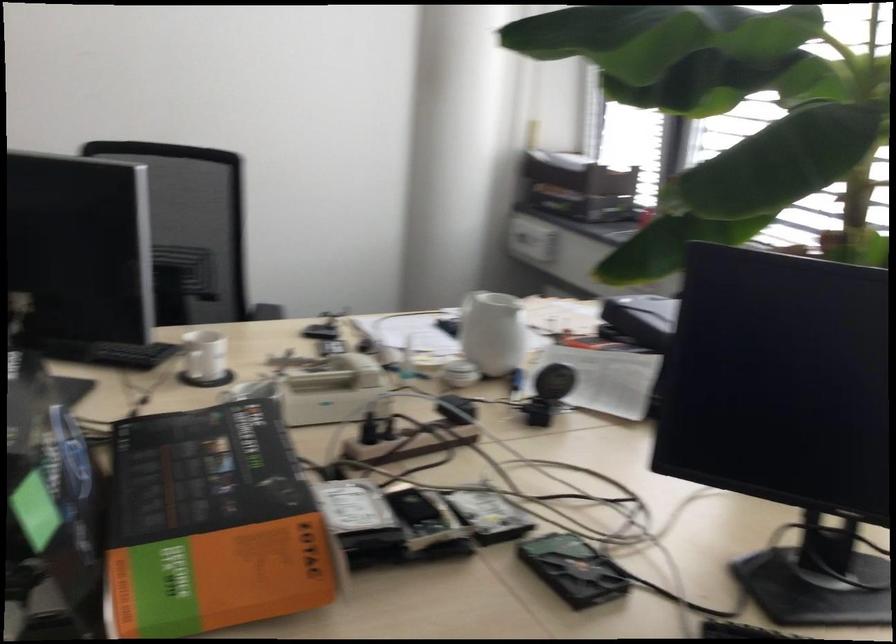
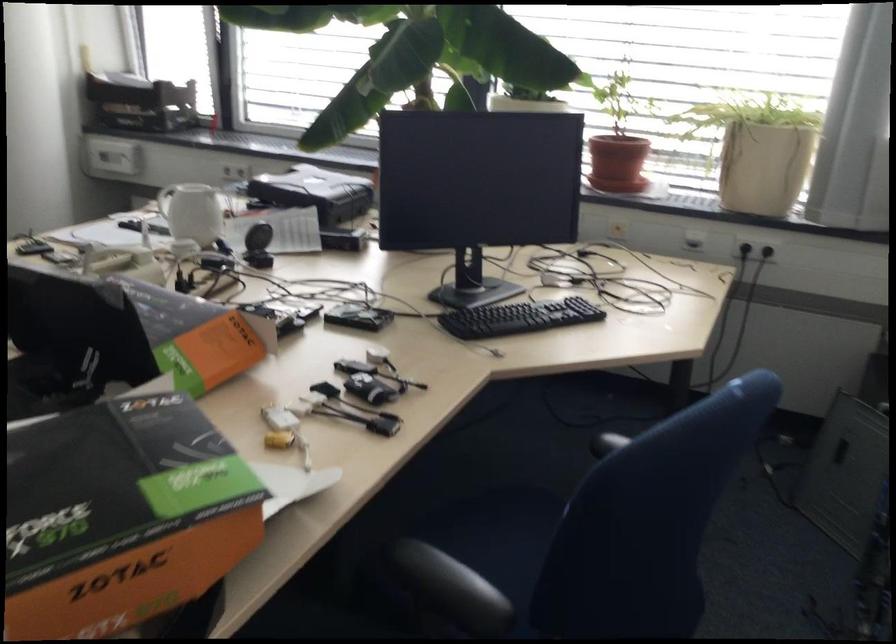
Find the pixel in the second image that matches point 90,496 in the first image.

(108, 326)